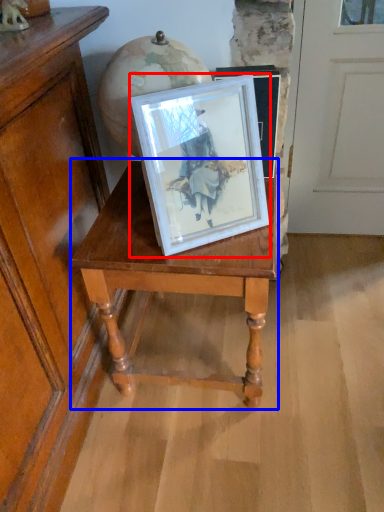
Question: Which of the following is the closest to the observer, picture frame (highlighted by a red box) or table (highlighted by a blue box)?

Choices:
 (A) picture frame
 (B) table

Answer: (A)